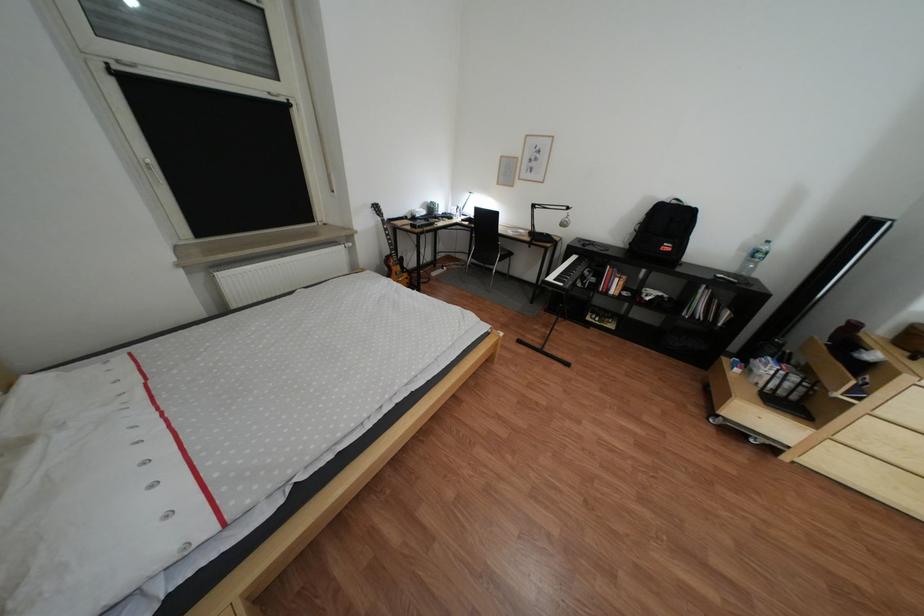
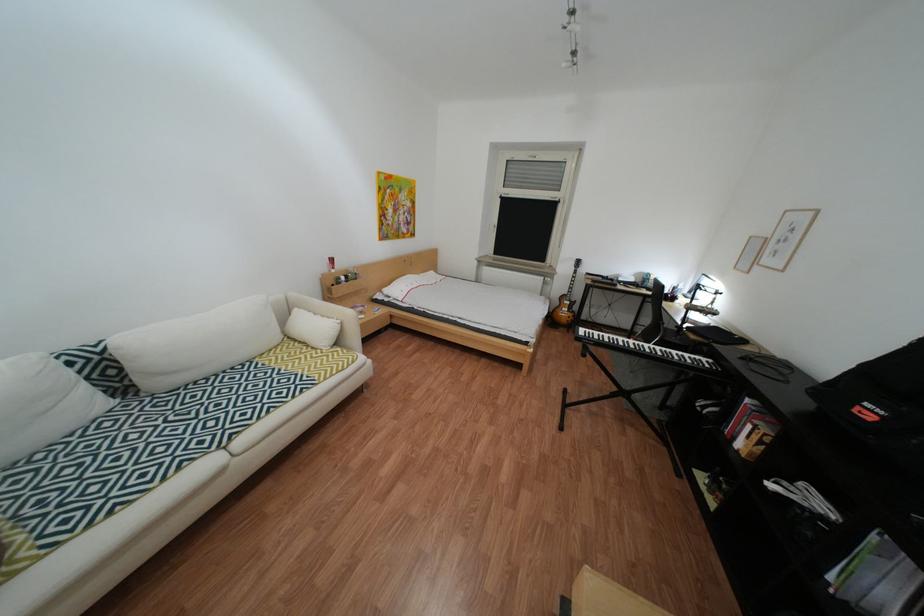
In the second image, find the point that corresponds to point 624,291 in the first image.

(749, 439)